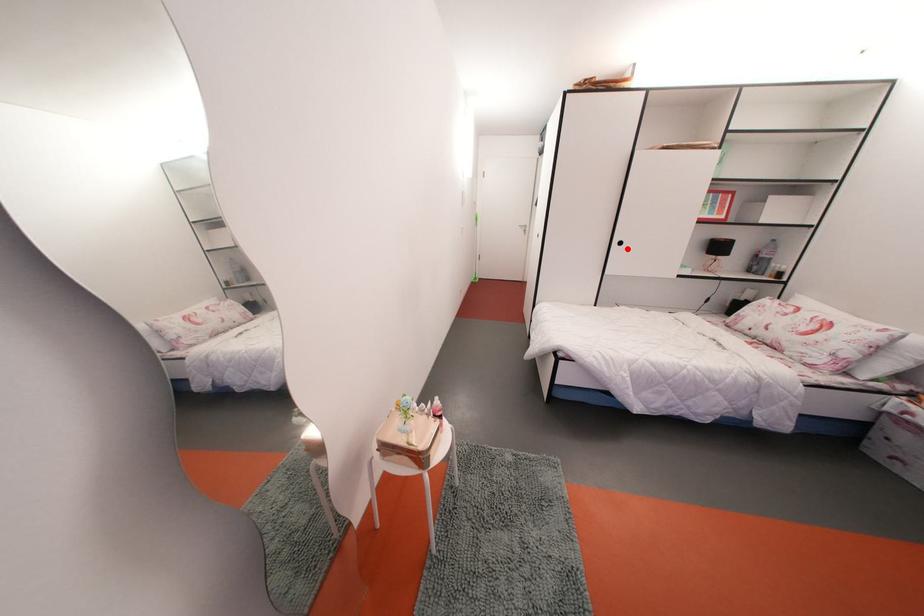
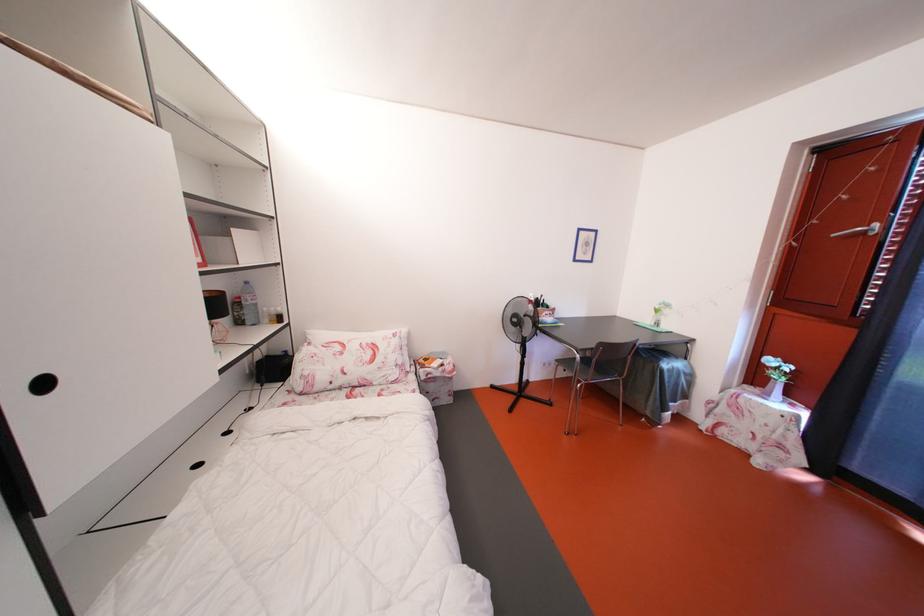
Locate, in the second image, the point that corresponds to the highlighted location in the first image.

(52, 390)